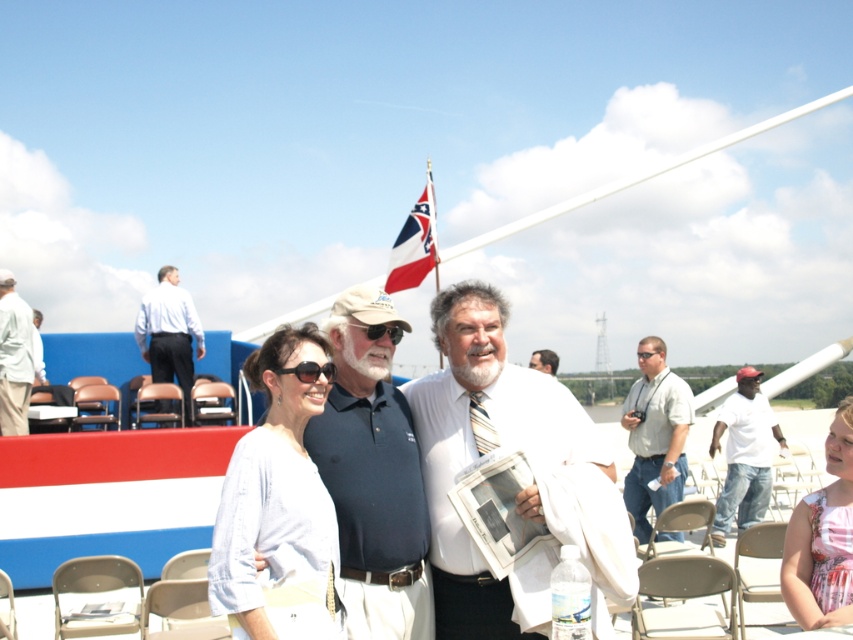
You are a photographer taking a picture of the matte black sunglasses at center and the light brown leather jacket at center. Which object will be more visible in the photo?

The matte black sunglasses at center will be more visible in the photo because it is in front of the light brown leather jacket at center.

You are a photographer at this event and want to ensure that both the white striped tie at center and the light beige cotton shirt at left are clearly visible in the photo. Based on their positions, which one is closer to the camera?

The white striped tie at center is in front of the light beige cotton shirt at left, so it is closer to the camera.